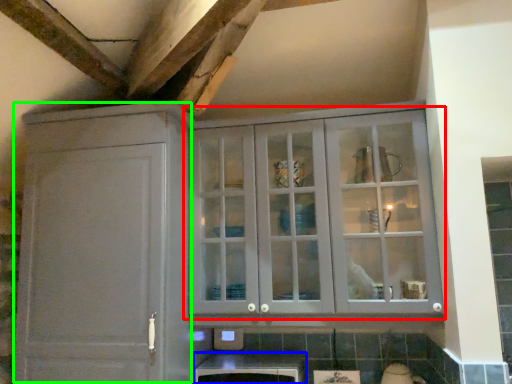
Question: Which object is the farthest from cupboard (highlighted by a red box)? Choose among these: cabinetry (highlighted by a blue box) or cabinetry (highlighted by a green box).

Choices:
 (A) cabinetry
 (B) cabinetry

Answer: (A)